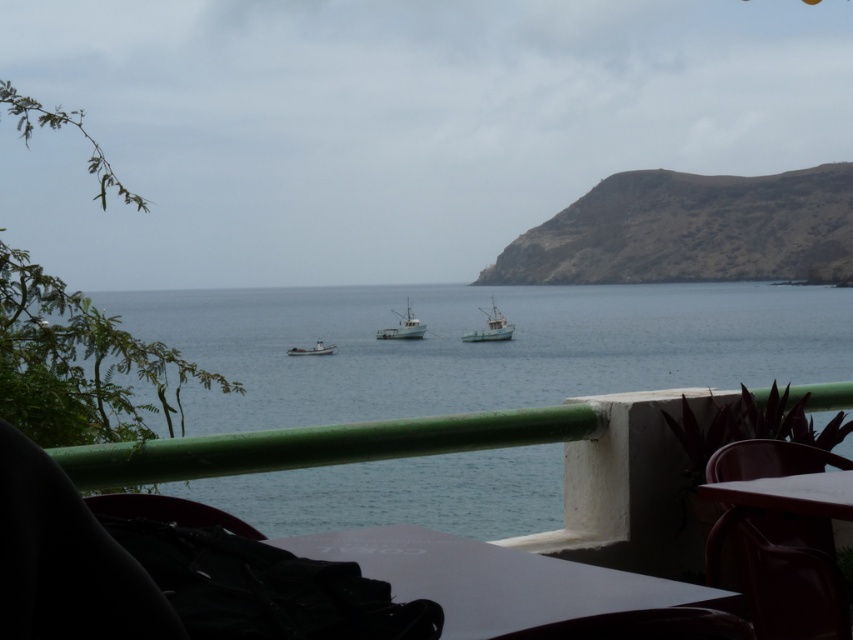
Question: Which point is farther to the camera?

Choices:
 (A) (494, 291)
 (B) (166, 513)

Answer: (A)

Question: Is matte plastic chair at lower right above green matte boat at center?

Choices:
 (A) yes
 (B) no

Answer: (B)

Question: Which object appears closest to the camera in this image?

Choices:
 (A) white matte fishing boat at center
 (B) wooden table at lower right
 (C) blue water at center
 (D) black leather chair at lower left

Answer: (D)

Question: Based on their relative distances, which object is farther from the white matte fishing boat at center?

Choices:
 (A) black leather chair at lower left
 (B) white wooden boat at center
 (C) matte plastic chair at lower right

Answer: (A)

Question: Observing the image, what is the correct spatial positioning of white glossy table at lower center in reference to white matte fishing boat at center?

Choices:
 (A) right
 (B) left

Answer: (A)

Question: Observing the image, what is the correct spatial positioning of white glossy table at lower center in reference to matte plastic chair at lower right?

Choices:
 (A) right
 (B) left

Answer: (B)